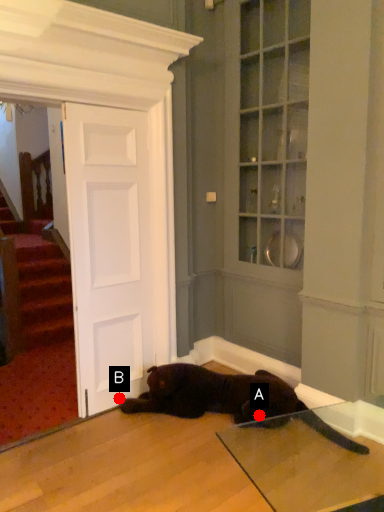
Question: Two points are circled on the image, labeled by A and B beside each circle. Among these points, which one is nearest to the camera?

Choices:
 (A) A is closer
 (B) B is closer

Answer: (A)